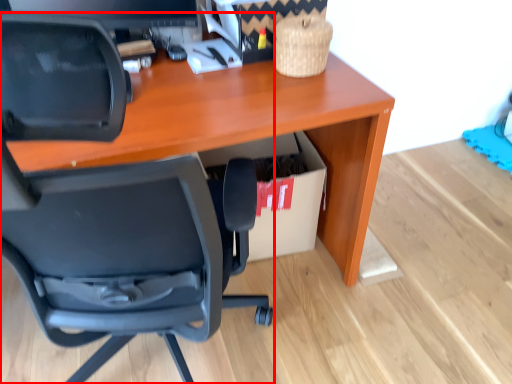
Question: Considering the relative positions of chair (annotated by the red box) and cardboard box in the image provided, where is chair (annotated by the red box) located with respect to the staircase?

Choices:
 (A) left
 (B) right

Answer: (A)